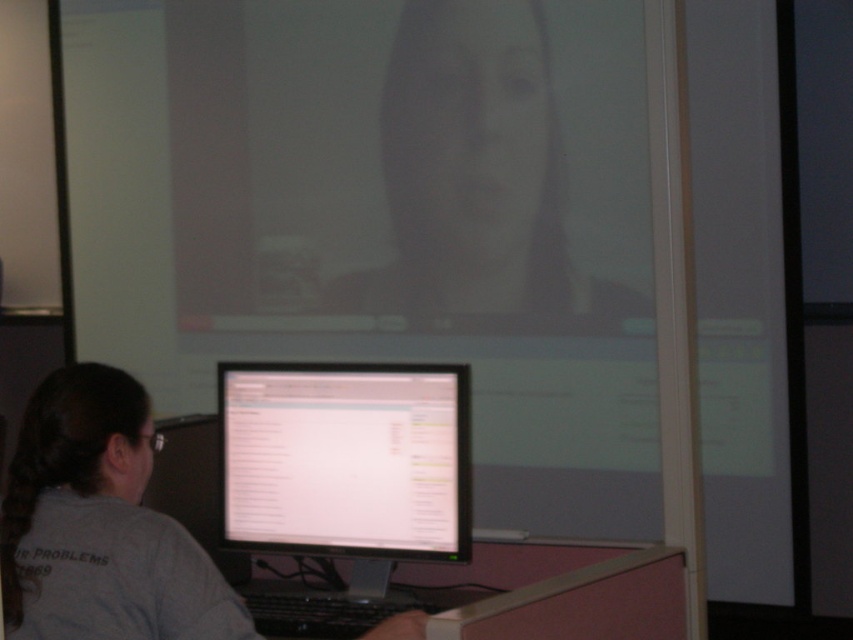
You are standing in front of the desk and see a point at coordinates (383, 216). Which object is this point located on?

The point at coordinates (383, 216) is located on the matte white screen at upper center.

You are standing at the point labeled point (498, 232) and want to move to the point labeled point (218, 35). Given that you can only move forward and cannot turn around, will you be able to reach your destination?

Point (218, 35) is behind point (498, 232), so you cannot reach it without turning around or moving backward since you can only move forward.

You are setting up a presentation and need to choose between the matte white screen at upper center and the white glossy monitor at center. Which one has a greater width?

The matte white screen at upper center has a greater width than the white glossy monitor at center according to the description.